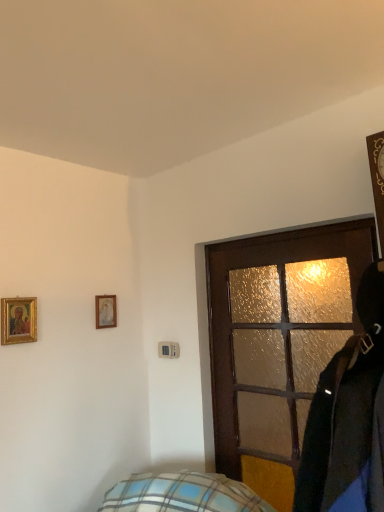
The image size is (384, 512). What do you see at coordinates (105, 311) in the screenshot?
I see `matte white picture frame at upper left, the second picture frame from the front` at bounding box center [105, 311].

What do you see at coordinates (277, 342) in the screenshot? I see `brown textured door at center` at bounding box center [277, 342].

This screenshot has width=384, height=512. What are the coordinates of `matte white picture frame at upper left, the second picture frame from the left` in the screenshot? It's located at (105, 311).

Is gold-framed picture at upper left, the first picture frame positioned from the front, aimed at matte white picture frame at upper left, which is the 1th picture frame from right to left?

No, gold-framed picture at upper left, the first picture frame positioned from the front, is not turned towards matte white picture frame at upper left, which is the 1th picture frame from right to left.

Is gold-framed picture at upper left, marked as the second picture frame in a back-to-front arrangement, shorter than matte white picture frame at upper left, the first picture frame when ordered from back to front?

No.

From a real-world perspective, is gold-framed picture at upper left, which is counted as the second picture frame, starting from the right, positioned above or below matte white picture frame at upper left, the second picture frame from the front?

In terms of real-world spatial position, gold-framed picture at upper left, which is counted as the second picture frame, starting from the right, is below matte white picture frame at upper left, the second picture frame from the front.

Can you confirm if gold-framed picture at upper left, the first picture frame positioned from the front, is positioned to the left of matte white picture frame at upper left, the second picture frame from the front?

Yes, gold-framed picture at upper left, the first picture frame positioned from the front, is to the left of matte white picture frame at upper left, the second picture frame from the front.

Looking at this image, from a real-world perspective, is matte white picture frame at upper left, the second picture frame from the front, above or below brown textured door at center?

matte white picture frame at upper left, the second picture frame from the front, is above brown textured door at center.

Is matte white picture frame at upper left, the first picture frame when ordered from back to front, next to brown textured door at center and touching it?

No, matte white picture frame at upper left, the first picture frame when ordered from back to front, is not with brown textured door at center.

From the picture: Is matte white picture frame at upper left, which is the 1th picture frame from right to left, positioned with its back to brown textured door at center?

No, matte white picture frame at upper left, which is the 1th picture frame from right to left, is not facing away from brown textured door at center.

Does point (104, 309) appear closer or farther from the camera than point (270, 364)?

Point (104, 309) is positioned farther from the camera compared to point (270, 364).

Is brown textured door at center thinner than matte white picture frame at upper left, which is the 1th picture frame from right to left?

In fact, brown textured door at center might be wider than matte white picture frame at upper left, which is the 1th picture frame from right to left.

Considering the points (240, 452) and (99, 318), which point is behind, point (240, 452) or point (99, 318)?

The point (99, 318) is farther.

From the image's perspective, between brown textured door at center and matte white picture frame at upper left, the first picture frame when ordered from back to front, who is located below?

brown textured door at center is shown below in the image.

Between brown textured door at center and matte white picture frame at upper left, the second picture frame from the front, which one has smaller size?

matte white picture frame at upper left, the second picture frame from the front.

Is gold-framed picture at upper left, the first picture frame positioned from the front, not close to brown textured door at center?

Indeed, gold-framed picture at upper left, the first picture frame positioned from the front, is not near brown textured door at center.

Considering the positions of objects gold-framed picture at upper left, marked as the second picture frame in a back-to-front arrangement, and brown textured door at center in the image provided, who is behind, gold-framed picture at upper left, marked as the second picture frame in a back-to-front arrangement, or brown textured door at center?

gold-framed picture at upper left, marked as the second picture frame in a back-to-front arrangement, is further from the camera.

Considering the relative sizes of gold-framed picture at upper left, the first picture frame from the left, and brown textured door at center in the image provided, is gold-framed picture at upper left, the first picture frame from the left, wider than brown textured door at center?

Incorrect, the width of gold-framed picture at upper left, the first picture frame from the left, does not surpass that of brown textured door at center.

The width and height of the screenshot is (384, 512). I want to click on picture frame above the matte white picture frame at upper left, the first picture frame when ordered from back to front (from the image's perspective), so click(x=18, y=320).

From a real-world perspective, which object rests below the other?

gold-framed picture at upper left, which is counted as the second picture frame, starting from the right.

Which of these two, matte white picture frame at upper left, the first picture frame when ordered from back to front, or gold-framed picture at upper left, marked as the second picture frame in a back-to-front arrangement, stands shorter?

matte white picture frame at upper left, the first picture frame when ordered from back to front.

Based on the photo, is matte white picture frame at upper left, which is the 1th picture frame from right to left, oriented away from gold-framed picture at upper left, which is counted as the second picture frame, starting from the right?

That's not correct — matte white picture frame at upper left, which is the 1th picture frame from right to left, is not looking away from gold-framed picture at upper left, which is counted as the second picture frame, starting from the right.

Is point (251, 292) behind point (31, 338)?

That is True.

Based on the photo, which is more to the left, brown textured door at center or gold-framed picture at upper left, the first picture frame from the left?

From the viewer's perspective, gold-framed picture at upper left, the first picture frame from the left, appears more on the left side.

Considering the relative sizes of brown textured door at center and gold-framed picture at upper left, the first picture frame from the left, in the image provided, is brown textured door at center thinner than gold-framed picture at upper left, the first picture frame from the left,?

Incorrect, the width of brown textured door at center is not less than that of gold-framed picture at upper left, the first picture frame from the left.

Where is `picture frame to the right of gold-framed picture at upper left, the first picture frame positioned from the front`? The width and height of the screenshot is (384, 512). picture frame to the right of gold-framed picture at upper left, the first picture frame positioned from the front is located at coordinates (105, 311).

The image size is (384, 512). There is a brown textured door at center. Find the location of `the 1st picture frame above it (from the image's perspective)`. the 1st picture frame above it (from the image's perspective) is located at coordinates (105, 311).

Considering their positions, is matte white picture frame at upper left, which is the 1th picture frame from right to left, positioned further to gold-framed picture at upper left, the first picture frame positioned from the front, than brown textured door at center?

brown textured door at center.

From the picture: Considering their positions, is gold-framed picture at upper left, which is counted as the second picture frame, starting from the right, positioned further to brown textured door at center than matte white picture frame at upper left, which is the 1th picture frame from right to left?

Among the two, gold-framed picture at upper left, which is counted as the second picture frame, starting from the right, is located further to brown textured door at center.

Which object lies nearer to the anchor point matte white picture frame at upper left, which is the 1th picture frame from right to left, brown textured door at center or gold-framed picture at upper left, marked as the second picture frame in a back-to-front arrangement?

gold-framed picture at upper left, marked as the second picture frame in a back-to-front arrangement, lies closer to matte white picture frame at upper left, which is the 1th picture frame from right to left, than the other object.

When comparing their distances from matte white picture frame at upper left, the second picture frame from the left, does gold-framed picture at upper left, the first picture frame from the left, or brown textured door at center seem further?

Based on the image, brown textured door at center appears to be further to matte white picture frame at upper left, the second picture frame from the left.

Looking at the image, which one is located further to brown textured door at center, matte white picture frame at upper left, the second picture frame from the front, or gold-framed picture at upper left, the first picture frame from the left?

Based on the image, gold-framed picture at upper left, the first picture frame from the left, appears to be further to brown textured door at center.

Which object lies nearer to the anchor point gold-framed picture at upper left, marked as the second picture frame in a back-to-front arrangement, brown textured door at center or matte white picture frame at upper left, the second picture frame from the front?

The object closer to gold-framed picture at upper left, marked as the second picture frame in a back-to-front arrangement, is matte white picture frame at upper left, the second picture frame from the front.

Identify the location of picture frame between gold-framed picture at upper left, marked as the second picture frame in a back-to-front arrangement, and brown textured door at center. (105, 311).